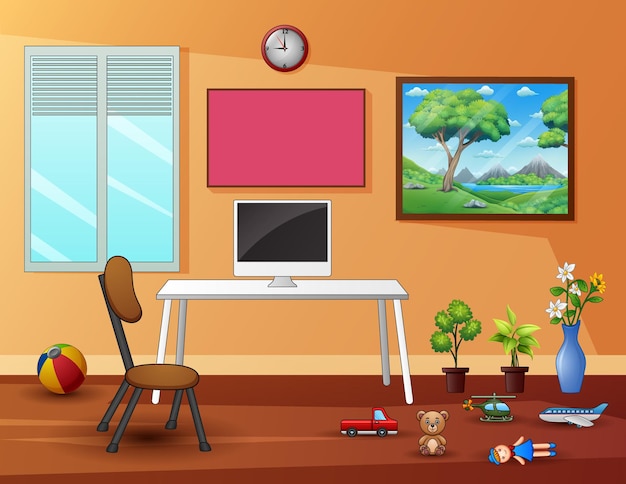
Locate an element on the screen. This screenshot has width=626, height=484. window pane - left side is located at coordinates (71, 213).